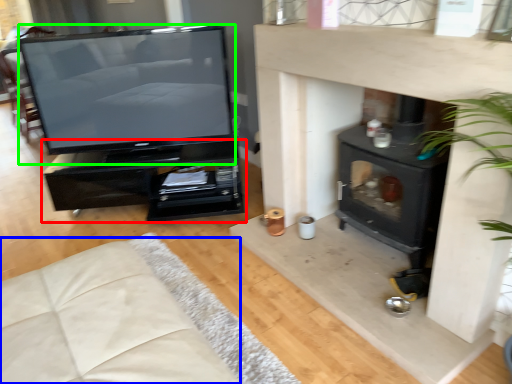
Question: Which is farther away from furniture (highlighted by a red box)? couch (highlighted by a blue box) or television (highlighted by a green box)?

Choices:
 (A) couch
 (B) television

Answer: (A)